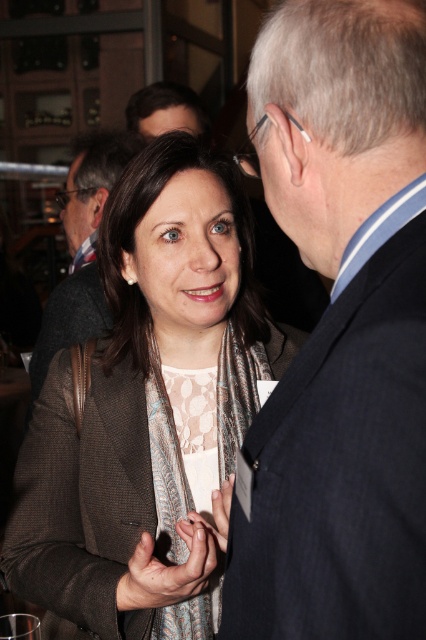
Is dark blue suit at center thinner than brown textured blazer at center?

Yes.

Which is in front, point (331, 465) or point (184, 476)?

Point (331, 465) is more forward.

Where is `dark blue suit at center`? The image size is (426, 640). dark blue suit at center is located at coordinates (340, 332).

Is brown textured blazer at center below transparent glass at upper center?

No.

Can you confirm if brown textured blazer at center is positioned above transparent glass at upper center?

Correct, brown textured blazer at center is located above transparent glass at upper center.

I want to click on brown textured blazer at center, so click(x=146, y=404).

Which is behind, point (75, 284) or point (187, 540)?

Point (75, 284)

Consider the image. Is dark gray suit at center wider than matte silver ring at center?

Indeed, dark gray suit at center has a greater width compared to matte silver ring at center.

Who is more distant from viewer, (45, 358) or (226, 529)?

The point (45, 358) is more distant.

Locate an element on the screen. The height and width of the screenshot is (640, 426). dark gray suit at center is located at coordinates (81, 248).